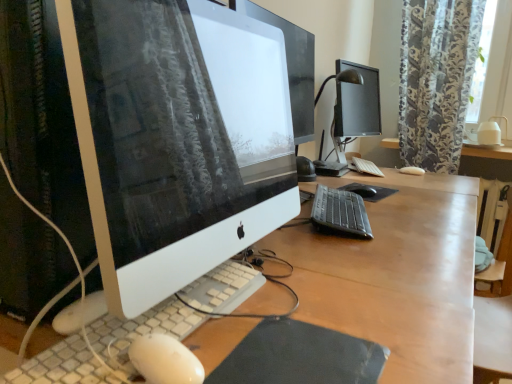
Where is `free location above white textured keyboard at center, the first computer keyboard from the left (from a real-world perspective)`? The image size is (512, 384). free location above white textured keyboard at center, the first computer keyboard from the left (from a real-world perspective) is located at coordinates (144, 317).